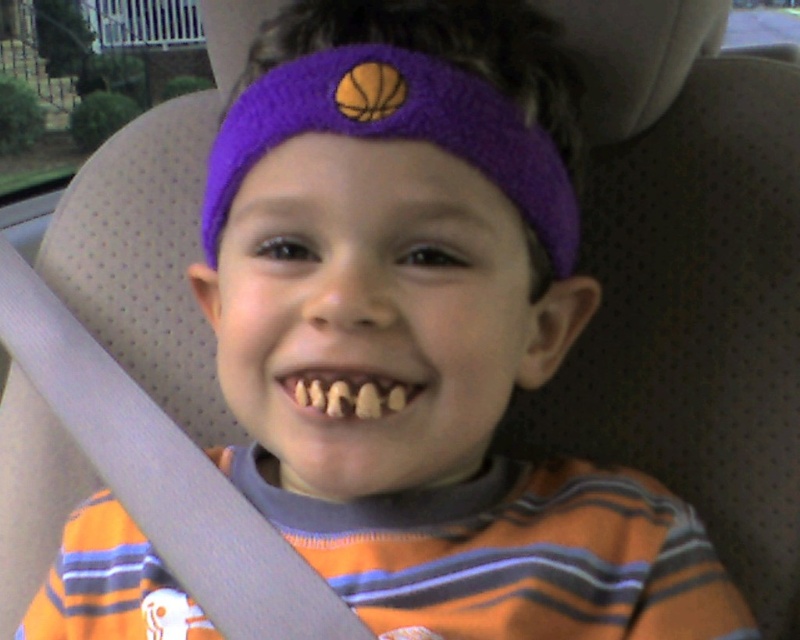
Based on the photo, who is taller, purple knitted headband at center or yellowish matte teeth at center?

purple knitted headband at center

Can you confirm if purple knitted headband at center is wider than yellowish matte teeth at center?

Indeed, purple knitted headband at center has a greater width compared to yellowish matte teeth at center.

Who is more distant from viewer, (x=356, y=112) or (x=368, y=380)?

Positioned behind is point (x=356, y=112).

Identify the location of purple knitted headband at center. The width and height of the screenshot is (800, 640). pos(396,132).